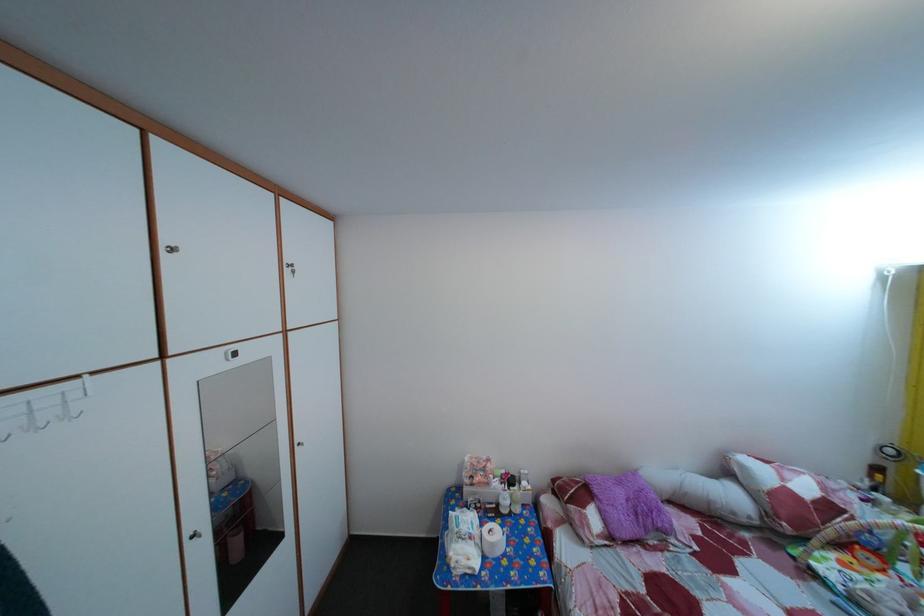
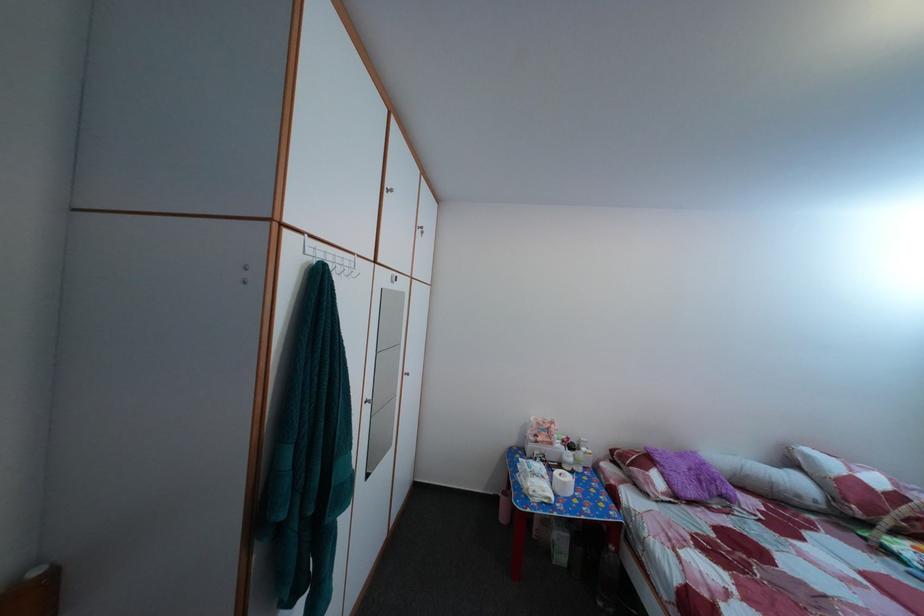
The point at (629, 491) is marked in the first image. Where is the corresponding point in the second image?

(689, 464)